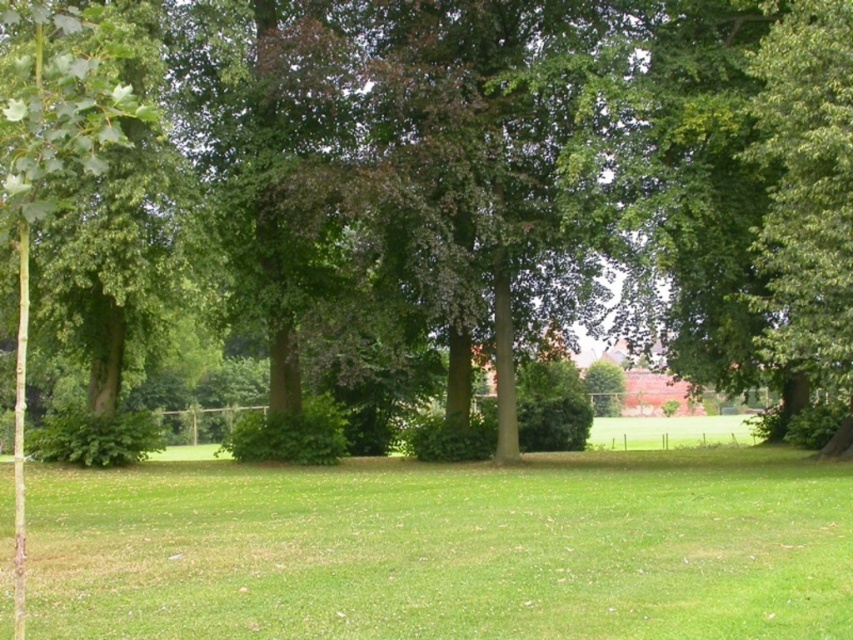
You are standing in the park and want to walk from point (686, 224) to point (708, 488). Which direction should you move to get closer to your destination?

You should move away from the camera because point (686, 224) is further to the camera than point (708, 488). Moving away from the camera will bring you closer to the destination.

You are a gardener planning to mow the green grass at center. However, you need to avoid damaging the green leafy tree at center. Based on the scene, can you determine if the tree is in a position that would interfere with mowing the grass?

The green leafy tree at center is above the green grass at center, so it is elevated and does not block access to the grass. Therefore, you can safely mow the green grass at center without damaging the tree.